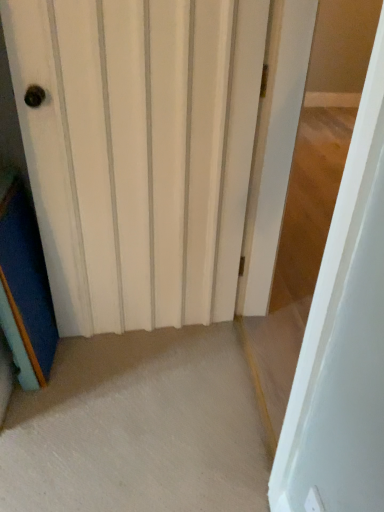
Question: From the image's perspective, would you say white wood door at center, positioned as the 1th door in left-to-right order, is positioned over white matte door at center, the 1th door when ordered from right to left?

Choices:
 (A) no
 (B) yes

Answer: (B)

Question: Can you confirm if white wood door at center, positioned as the 1th door in left-to-right order, is shorter than white matte door at center, the 1th door when ordered from right to left?

Choices:
 (A) no
 (B) yes

Answer: (B)

Question: Is white wood door at center, arranged as the second door when viewed from the right, with white matte door at center, the 1th door when ordered from right to left?

Choices:
 (A) yes
 (B) no

Answer: (B)

Question: Is white wood door at center, arranged as the second door when viewed from the right, positioned before white matte door at center, acting as the second door starting from the left?

Choices:
 (A) yes
 (B) no

Answer: (B)

Question: Is white wood door at center, positioned as the 1th door in left-to-right order, positioned far away from white matte door at center, the 1th door when ordered from right to left?

Choices:
 (A) yes
 (B) no

Answer: (B)

Question: Is white wood door at center, positioned as the 1th door in left-to-right order, positioned beyond the bounds of white matte door at center, the 1th door when ordered from right to left?

Choices:
 (A) yes
 (B) no

Answer: (A)

Question: Considering the relative sizes of white matte door at center, acting as the second door starting from the left, and white wood door at center, positioned as the 1th door in left-to-right order, in the image provided, is white matte door at center, acting as the second door starting from the left, wider than white wood door at center, positioned as the 1th door in left-to-right order,?

Choices:
 (A) yes
 (B) no

Answer: (A)

Question: Can you confirm if white matte door at center, the 1th door when ordered from right to left, is positioned to the right of white wood door at center, positioned as the 1th door in left-to-right order?

Choices:
 (A) yes
 (B) no

Answer: (A)

Question: Is white matte door at center, acting as the second door starting from the left, in contact with white wood door at center, arranged as the second door when viewed from the right?

Choices:
 (A) no
 (B) yes

Answer: (A)

Question: Is white matte door at center, the 1th door when ordered from right to left, taller than white wood door at center, arranged as the second door when viewed from the right?

Choices:
 (A) no
 (B) yes

Answer: (B)

Question: Does white matte door at center, the 1th door when ordered from right to left, contain white wood door at center, positioned as the 1th door in left-to-right order?

Choices:
 (A) yes
 (B) no

Answer: (B)

Question: From the image's perspective, is white matte door at center, acting as the second door starting from the left, below white wood door at center, positioned as the 1th door in left-to-right order?

Choices:
 (A) yes
 (B) no

Answer: (A)

Question: From the image's perspective, relative to white wood door at center, arranged as the second door when viewed from the right, is white matte door at center, acting as the second door starting from the left, above or below?

Choices:
 (A) above
 (B) below

Answer: (B)